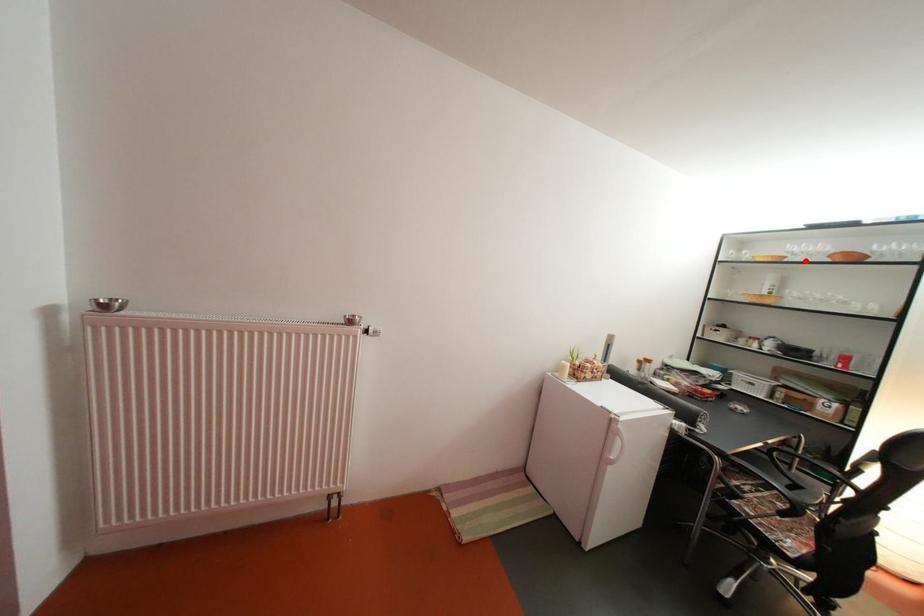
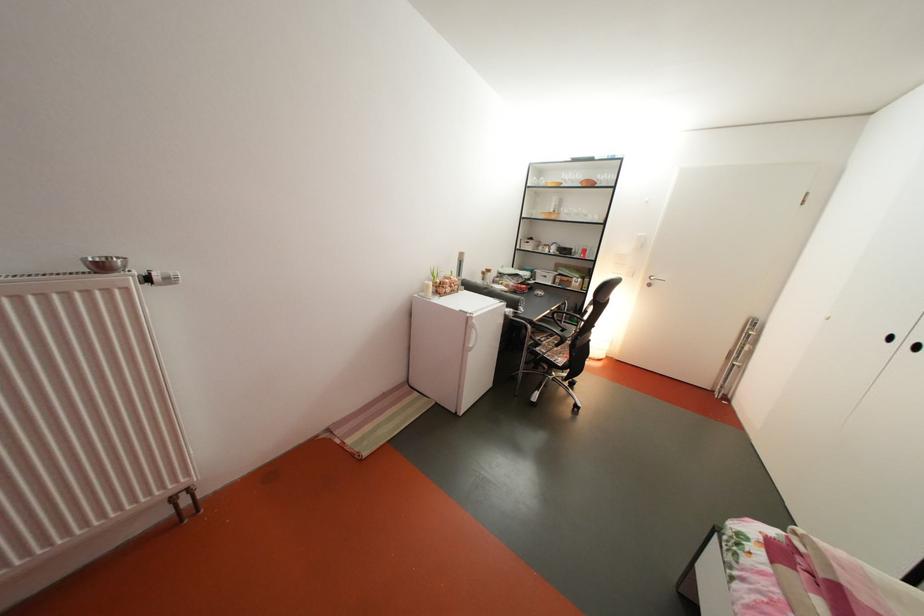
Find the pixel in the second image that matches the highlighted location in the first image.

(578, 188)